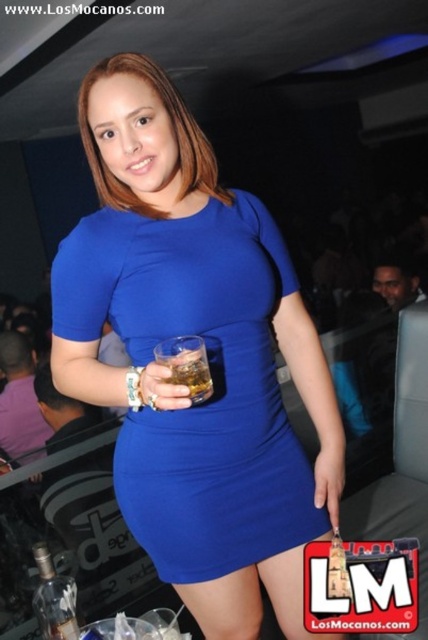
Question: Which of the following is the closest to the observer?

Choices:
 (A) (217, 339)
 (B) (208, 362)

Answer: (B)

Question: Which object appears closest to the camera in this image?

Choices:
 (A) translucent glass at center
 (B) royal blue jersey dress at center

Answer: (A)

Question: Is royal blue jersey dress at center below translucent glass at center?

Choices:
 (A) yes
 (B) no

Answer: (A)

Question: In this image, where is royal blue jersey dress at center located relative to translucent glass at center?

Choices:
 (A) left
 (B) right

Answer: (B)

Question: Is the position of royal blue jersey dress at center less distant than that of translucent glass at center?

Choices:
 (A) no
 (B) yes

Answer: (A)

Question: Which point is farther from the camera taking this photo?

Choices:
 (A) pos(270,410)
 (B) pos(202,340)

Answer: (A)